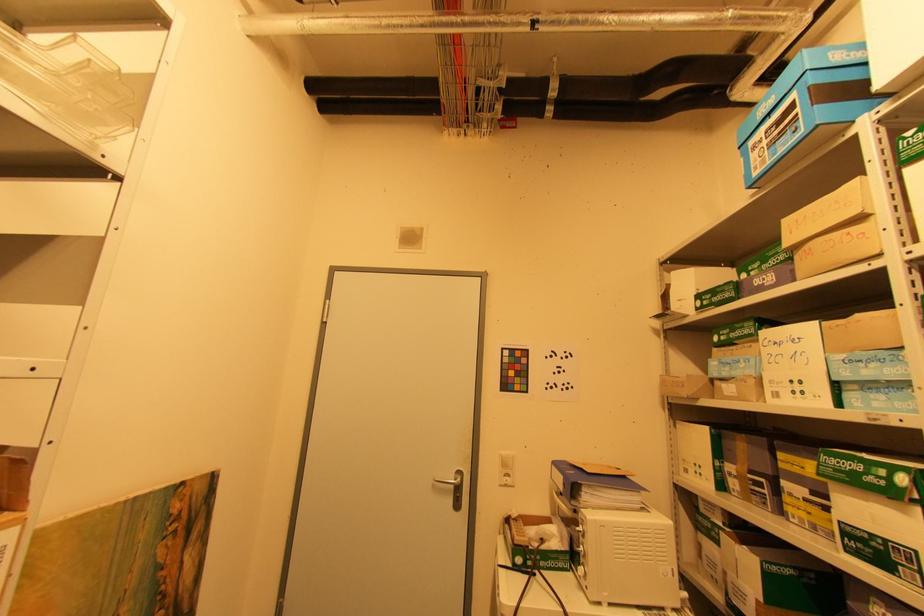
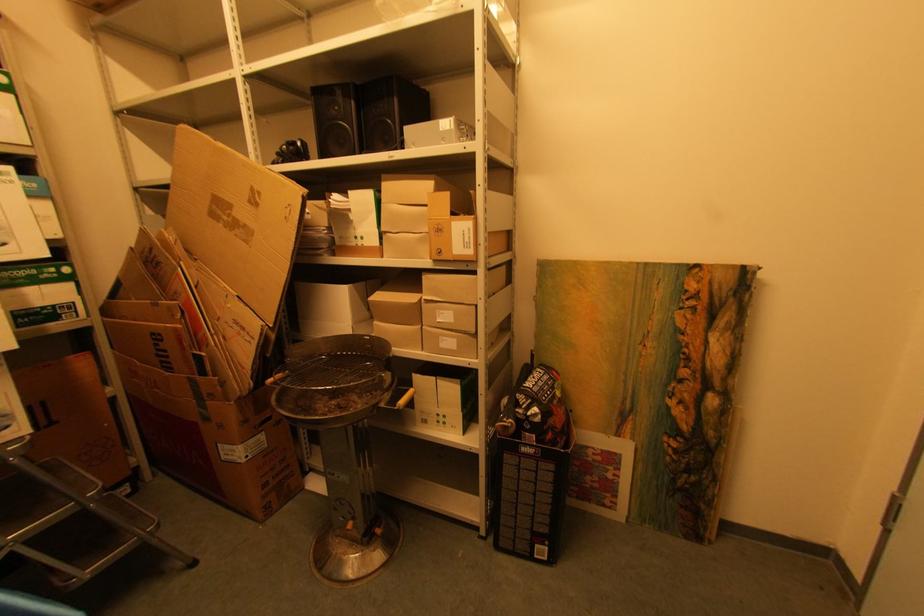
Question: Based on the continuous images, in which direction is the camera rotating? Reply with the corresponding letter.

Choices:
 (A) Left
 (B) Right
 (C) Up
 (D) Down

Answer: (A)